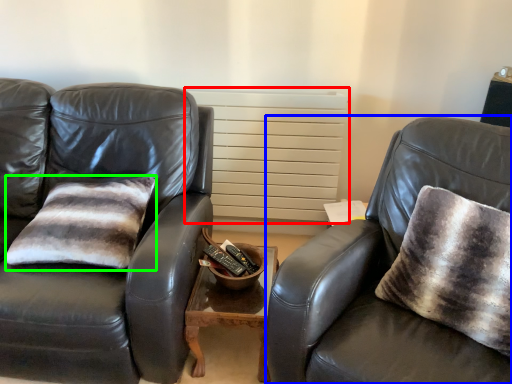
Question: Considering the real-world distances, which object is closest to radiator (highlighted by a red box)? chair (highlighted by a blue box) or pillow (highlighted by a green box).

Choices:
 (A) chair
 (B) pillow

Answer: (B)